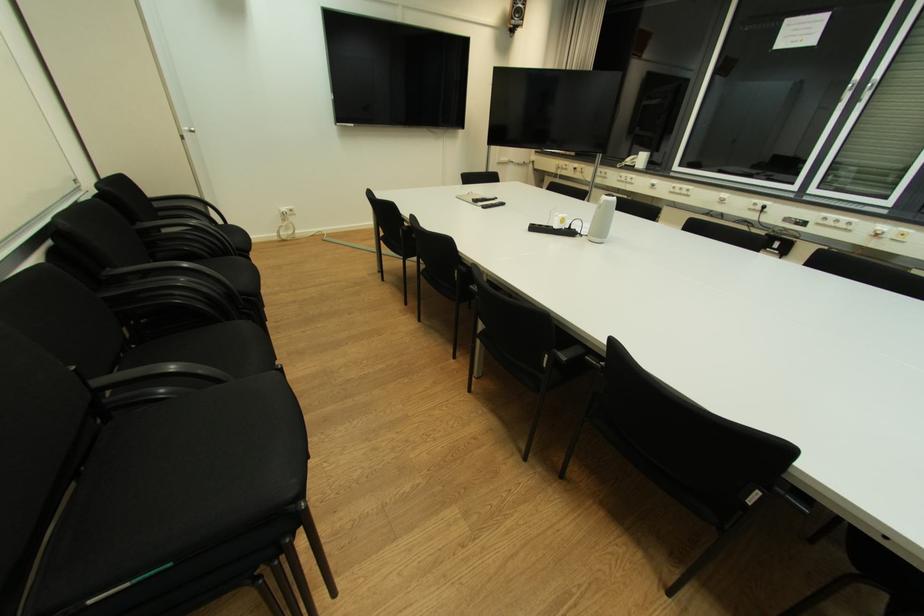
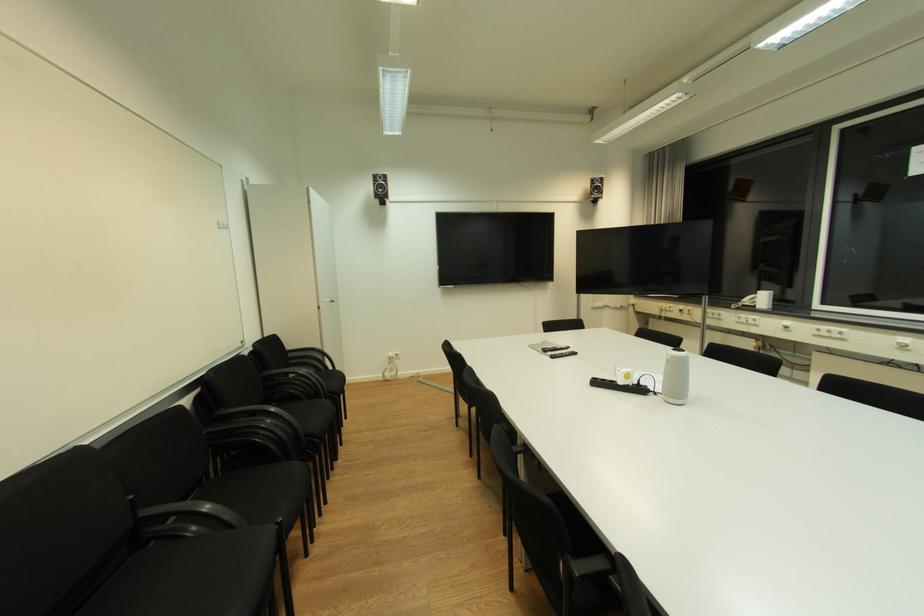
Find the pixel in the second image that matches (562,228) in the first image.

(626, 384)